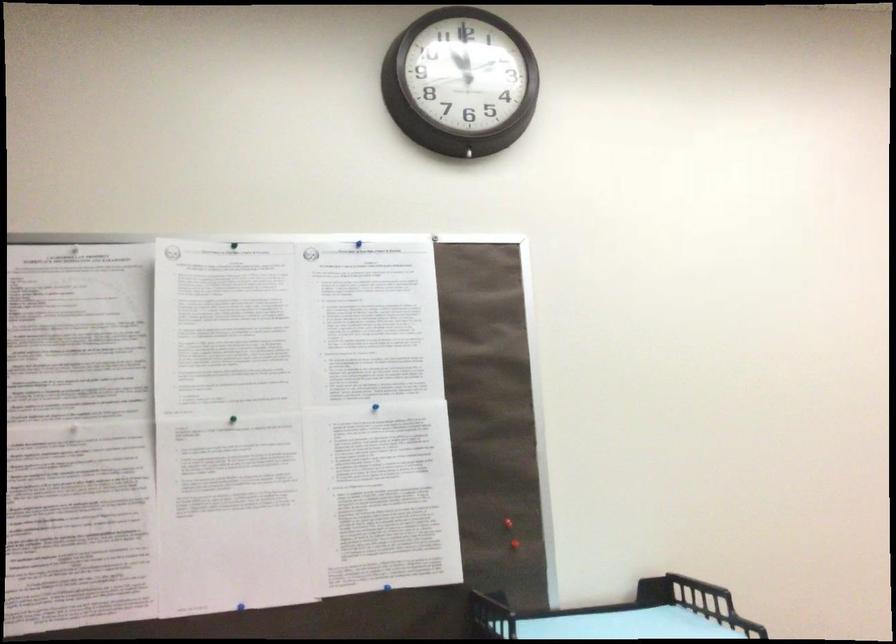
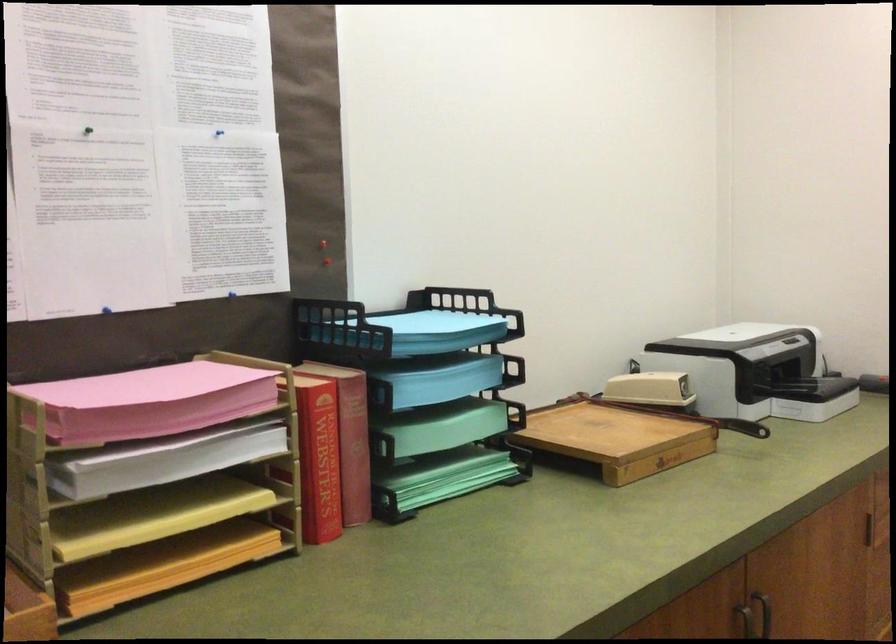
Find the pixel in the second image that matches the point at 509,533 in the first image.

(323, 252)